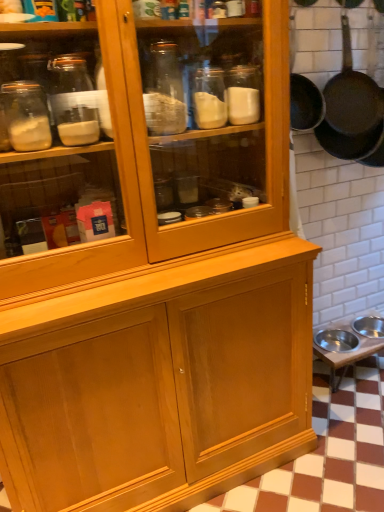
Question: Is dark brown matte frying pan at upper right not within metallic silver table at lower right?

Choices:
 (A) yes
 (B) no

Answer: (A)

Question: From the image's perspective, is dark brown matte frying pan at upper right beneath metallic silver table at lower right?

Choices:
 (A) no
 (B) yes

Answer: (A)

Question: Is dark brown matte frying pan at upper right shorter than metallic silver table at lower right?

Choices:
 (A) no
 (B) yes

Answer: (A)

Question: Are dark brown matte frying pan at upper right and metallic silver table at lower right far apart?

Choices:
 (A) yes
 (B) no

Answer: (B)

Question: Is dark brown matte frying pan at upper right smaller than metallic silver table at lower right?

Choices:
 (A) no
 (B) yes

Answer: (B)

Question: Considering the relative sizes of dark brown matte frying pan at upper right and metallic silver table at lower right in the image provided, is dark brown matte frying pan at upper right thinner than metallic silver table at lower right?

Choices:
 (A) no
 (B) yes

Answer: (B)

Question: Is metallic silver table at lower right located outside dark brown matte frying pan at upper right?

Choices:
 (A) yes
 (B) no

Answer: (A)

Question: Considering the relative sizes of metallic silver table at lower right and dark brown matte frying pan at upper right in the image provided, is metallic silver table at lower right smaller than dark brown matte frying pan at upper right?

Choices:
 (A) yes
 (B) no

Answer: (B)

Question: Could you tell me if metallic silver table at lower right is turned towards dark brown matte frying pan at upper right?

Choices:
 (A) yes
 (B) no

Answer: (B)

Question: Is metallic silver table at lower right to the right of dark brown matte frying pan at upper right from the viewer's perspective?

Choices:
 (A) yes
 (B) no

Answer: (A)

Question: From the image's perspective, is metallic silver table at lower right on top of dark brown matte frying pan at upper right?

Choices:
 (A) yes
 (B) no

Answer: (B)

Question: From a real-world perspective, does metallic silver table at lower right sit lower than dark brown matte frying pan at upper right?

Choices:
 (A) yes
 (B) no

Answer: (A)

Question: Is dark brown matte frying pan at upper right taller or shorter than metallic silver table at lower right?

Choices:
 (A) tall
 (B) short

Answer: (A)